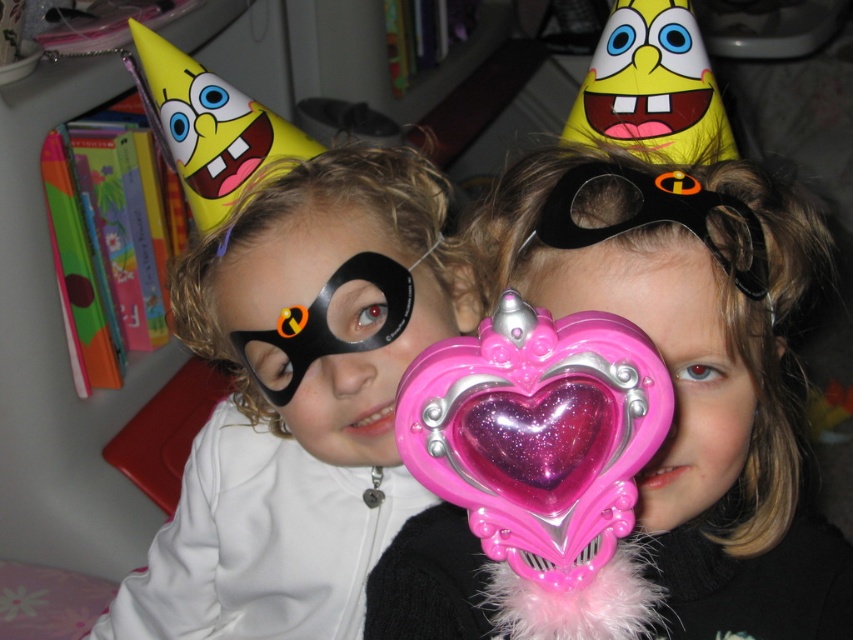
Who is shorter, pink glossy heart at center or black matte mask at upper center?

With less height is black matte mask at upper center.

Between pink glossy heart at center and black matte mask at upper center, which one appears on the right side from the viewer's perspective?

black matte mask at upper center

This screenshot has width=853, height=640. In order to click on pink glossy heart at center in this screenshot , I will do point(537,433).

You are a GUI agent. You are given a task and a screenshot of the screen. Output one action in this format:
    pyautogui.click(x=<x>, y=<y>)
    Task: Click on the pink glossy heart at center
    
    Given the screenshot: What is the action you would take?
    pyautogui.click(x=537, y=433)

Between point (265, 484) and point (648, 205), which one is positioned in front?

Point (648, 205)

Which is more to the right, black matte mask at left or black matte mask at upper center?

black matte mask at upper center

I want to click on black matte mask at left, so click(x=300, y=401).

Is point (373, 176) in front of point (440, 396)?

No, (373, 176) is behind (440, 396).

Between black matte mask at left and pink glossy heart at center, which one has more height?

black matte mask at left is taller.

Where is `black matte mask at left`? The height and width of the screenshot is (640, 853). black matte mask at left is located at coordinates (300, 401).

Locate an element on the screen. This screenshot has width=853, height=640. black matte mask at left is located at coordinates (300, 401).